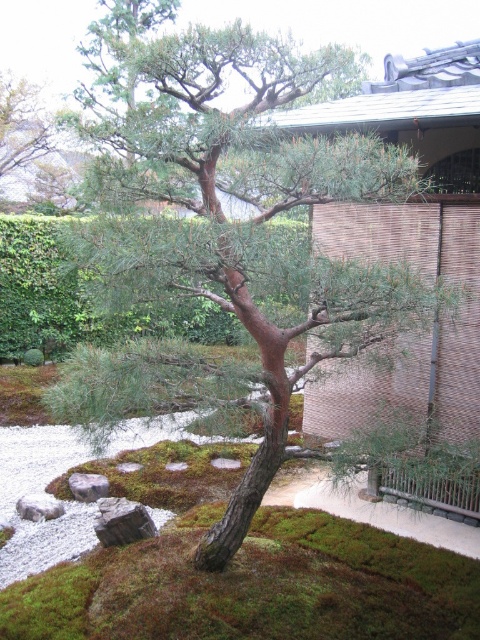
Does gray rough rock at lower left have a greater width compared to gray/rough rock at lower left?

Yes.

The height and width of the screenshot is (640, 480). Find the location of `gray rough rock at lower left`. gray rough rock at lower left is located at coordinates (x=121, y=522).

Locate an element on the screen. This screenshot has height=640, width=480. gray rough rock at lower left is located at coordinates (121, 522).

Is gray rough rock at lower left positioned in front of gray rough stone at lower left?

That is True.

Does point (120, 528) come in front of point (40, 504)?

Yes.

Who is more distant from viewer, (143, 532) or (55, 516)?

The point (55, 516) is more distant.

Find the location of `gray rough rock at lower left`. gray rough rock at lower left is located at coordinates (121, 522).

Is gray rough stone at lower left thinner than gray/rough rock at lower left?

In fact, gray rough stone at lower left might be wider than gray/rough rock at lower left.

Is gray rough stone at lower left above gray/rough rock at lower left?

Incorrect, gray rough stone at lower left is not positioned above gray/rough rock at lower left.

At what (x,y) coordinates should I click in order to perform the action: click on gray rough stone at lower left. Please return your answer as a coordinate pair (x, y). The height and width of the screenshot is (640, 480). Looking at the image, I should click on (38, 506).